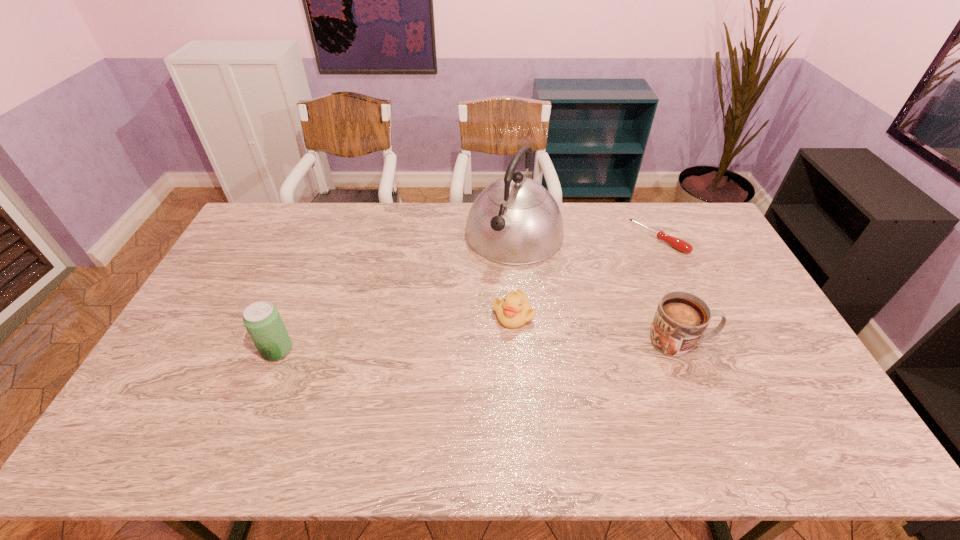
The width and height of the screenshot is (960, 540). What are the coordinates of `vacant space on the desktop that is between the leftmost object and the mug and is positioned from the spout of the tallest object` in the screenshot? It's located at (449, 347).

At what (x,y) coordinates should I click in order to perform the action: click on free spot on the desktop that is between the soda and the mug and is positioned at the tip of the screwdriver. Please return your answer as a coordinate pair (x, y). This screenshot has width=960, height=540. Looking at the image, I should click on (527, 345).

Locate an element on the screen. vacant space on the desktop that is between the leftmost object and the mug and is positioned on the front-facing side of the duckling is located at coordinates (457, 347).